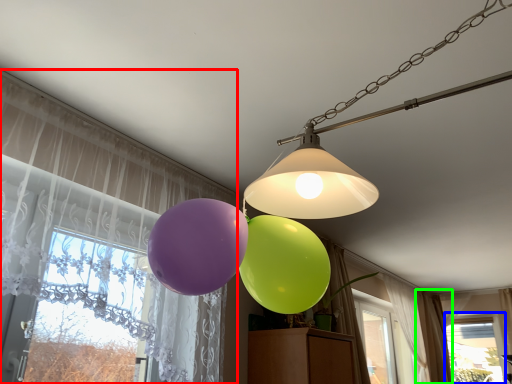
Question: Which object is positioned closest to curtain (highlighted by a red box)? Select from window (highlighted by a blue box) and curtain (highlighted by a green box).

Choices:
 (A) window
 (B) curtain

Answer: (B)